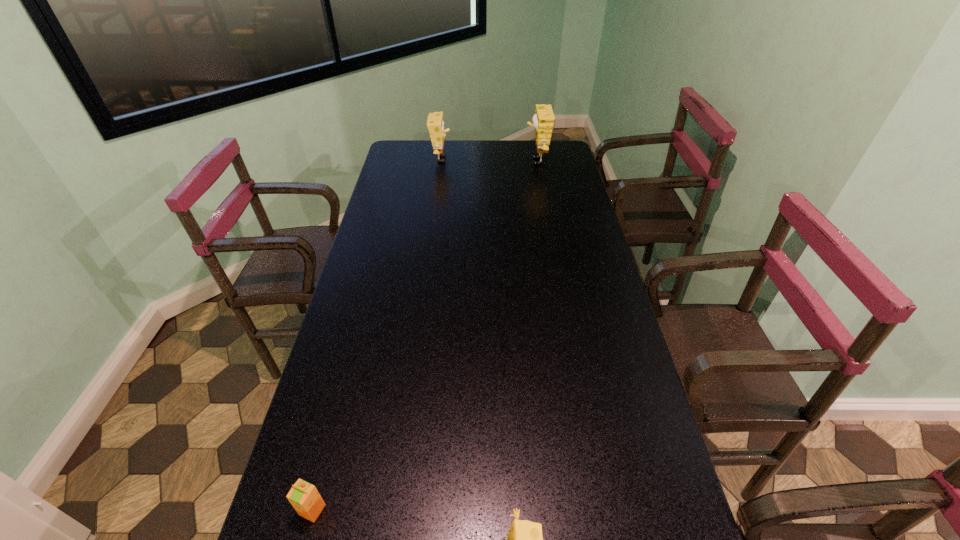
This screenshot has height=540, width=960. I want to click on vacant region located 0.260m on the back of the leftmost object, so click(x=344, y=390).

Where is `object that is at the left edge`? This screenshot has height=540, width=960. object that is at the left edge is located at coordinates pyautogui.click(x=304, y=497).

Where is `object that is at the right edge`? The height and width of the screenshot is (540, 960). object that is at the right edge is located at coordinates (543, 120).

What are the coordinates of `object that is at the far right corner` in the screenshot? It's located at (543, 120).

Locate an element on the screen. vacant space at the far edge of the desktop is located at coordinates (499, 153).

In the image, there is a desktop. Identify the location of vacant space at the left edge. This screenshot has height=540, width=960. (376, 238).

The image size is (960, 540). Find the location of `free space at the right edge`. free space at the right edge is located at coordinates (585, 353).

This screenshot has height=540, width=960. Identify the location of blank space at the far left corner of the desktop. (411, 144).

Where is `free space between the rightmost object and the leftmost sponge`? free space between the rightmost object and the leftmost sponge is located at coordinates (489, 160).

The width and height of the screenshot is (960, 540). Find the location of `free space between the rightmost object and the leftmost sponge`. free space between the rightmost object and the leftmost sponge is located at coordinates (489, 160).